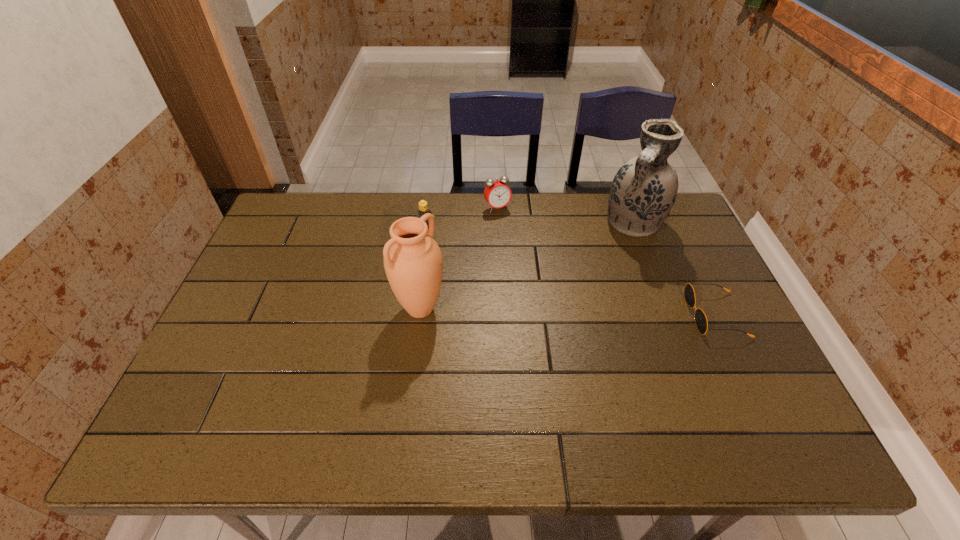
At what (x,y) coordinates should I click in order to perform the action: click on vacant region located 0.230m on the front-facing side of the alarm clock. Please return your answer as a coordinate pair (x, y). This screenshot has width=960, height=540. Looking at the image, I should click on (530, 259).

I want to click on vacant area located on the front-facing side of the alarm clock, so click(545, 284).

The height and width of the screenshot is (540, 960). What are the coordinates of `vacant region located with the handle on the side of the tallest object` in the screenshot? It's located at (608, 267).

Where is `vacant space located 0.330m with the handle on the side of the tallest object`? The image size is (960, 540). vacant space located 0.330m with the handle on the side of the tallest object is located at coordinates (582, 309).

Locate an element on the screen. The width and height of the screenshot is (960, 540). vacant space located with the handle on the side of the tallest object is located at coordinates (605, 271).

This screenshot has width=960, height=540. I want to click on free spot located 0.400m in front of the Lego, so click(540, 292).

Where is `free space located in front of the Lego`? This screenshot has width=960, height=540. free space located in front of the Lego is located at coordinates (478, 258).

Find the location of a particular element. vacant space located 0.180m in front of the Lego is located at coordinates (478, 258).

Locate an element on the screen. alarm clock that is at the far edge is located at coordinates (497, 193).

Locate an element on the screen. This screenshot has width=960, height=540. vase present at the far edge is located at coordinates coord(643,191).